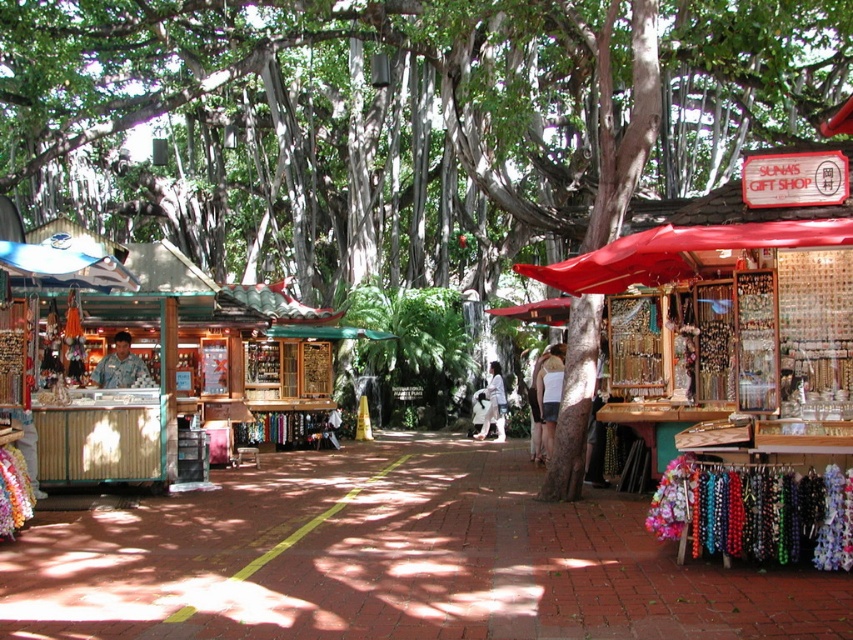
You are a customer in the outdoor market and see both the white cotton shirt at center and the white fabric at center. Which one is positioned to the right side?

The white cotton shirt at center is positioned to the right of the white fabric at center.

You are a customer at the market and see both the camouflage uniform at center and the light brown leather jacket at center. Which clothing item is placed higher up on the display rack?

The camouflage uniform at center is positioned over the light brown leather jacket at center, so it is placed higher up on the display rack.